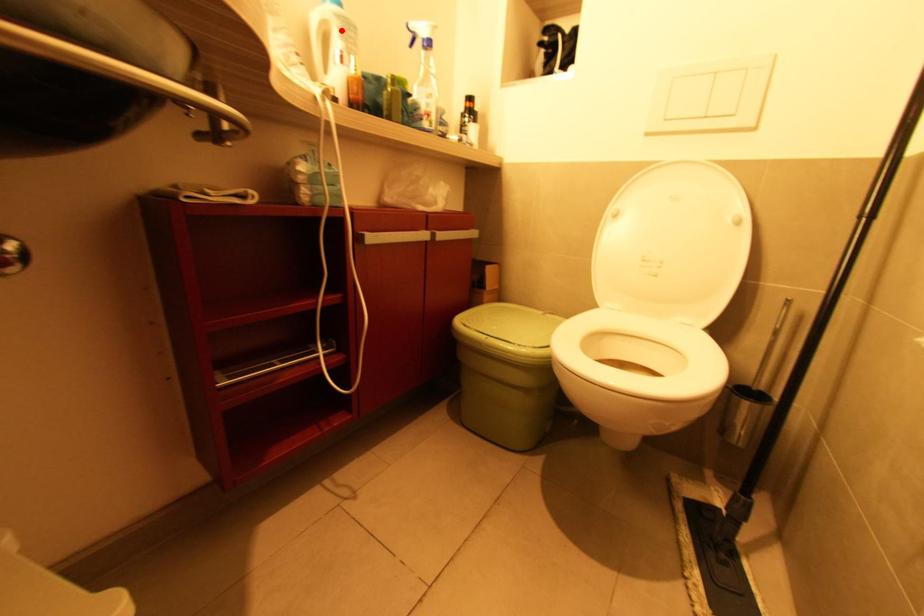
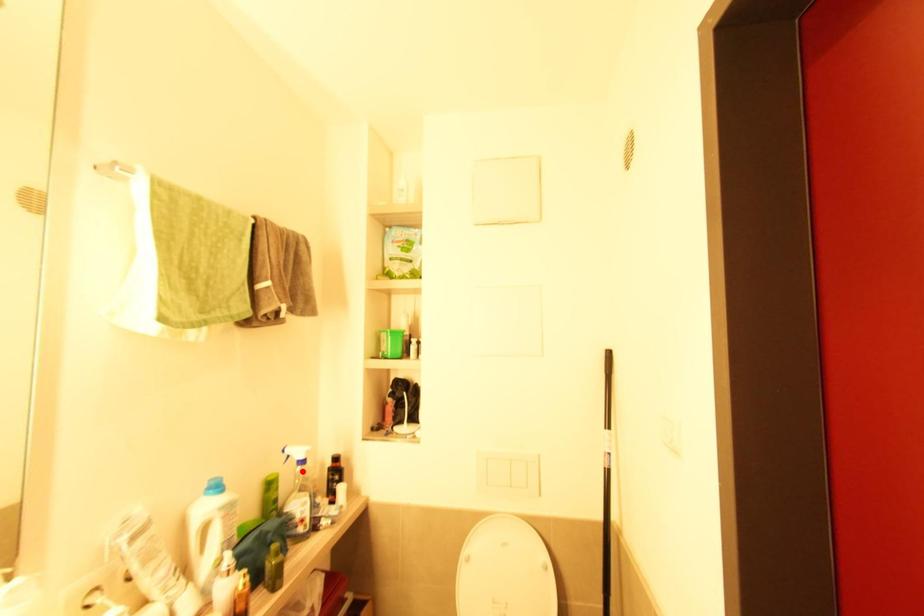
I am providing you with two images of the same scene from different viewpoints. A red point is marked on the first image and another point is marked on the second image. Is the marked point in image1 the same physical position as the marked point in image2?

No